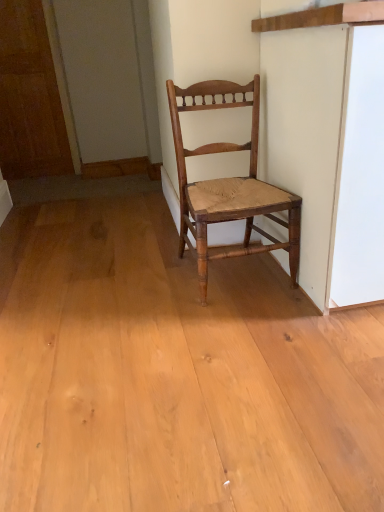
Identify the location of vacant space situated on the left part of natural wood chair at center. (157, 292).